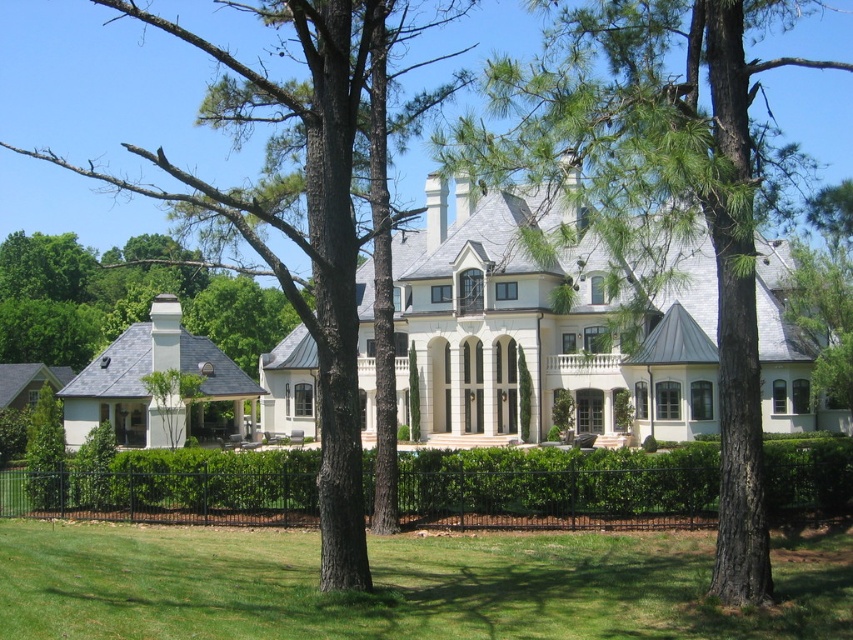
Question: Which of these objects is positioned closest to the smooth bark tree at center?

Choices:
 (A) green textured tree at center
 (B) green leafy hedge at center
 (C) green grass at lower center

Answer: (A)

Question: Which object is the farthest from the gray slate roof at left?

Choices:
 (A) smooth bark tree at center
 (B) green grass at lower center
 (C) white smooth mansion at center

Answer: (B)

Question: Which point is farther to the camera?

Choices:
 (A) green textured tree at center
 (B) green grass at lower center

Answer: (A)

Question: Is the position of white smooth mansion at center less distant than that of gray slate roof at left?

Choices:
 (A) no
 (B) yes

Answer: (B)

Question: Is green textured tree at center positioned behind gray slate roof at left?

Choices:
 (A) no
 (B) yes

Answer: (A)

Question: Can you confirm if white smooth mansion at center is positioned to the right of smooth bark tree at center?

Choices:
 (A) no
 (B) yes

Answer: (B)